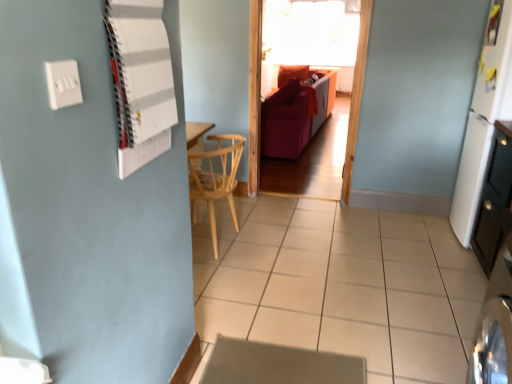
Measure the distance between white matte board at upper left and camera.

white matte board at upper left and camera are 37.68 inches apart.

The image size is (512, 384). What do you see at coordinates (295, 112) in the screenshot?
I see `velvet red couch at center` at bounding box center [295, 112].

The image size is (512, 384). What do you see at coordinates (215, 179) in the screenshot?
I see `natural wood chair at center` at bounding box center [215, 179].

At what (x,y) coordinates should I click in order to perform the action: click on white glossy dresser at right. Please return your answer as a coordinate pair (x, y). This screenshot has height=384, width=512. Looking at the image, I should click on [495, 199].

In order to face white plastic switch at upper left, should I rotate leftwards or rightwards?

Rotate your view left by about 24.011°.

Identify the location of transparent glass door at center. (254, 98).

Between natural wood chair at center and white matte board at upper left, which one appears on the left side from the viewer's perspective?

white matte board at upper left.

How different are the orientations of natural wood chair at center and white matte board at upper left in degrees?

They differ by 0.594 degrees in their facing directions.

Can you confirm if natural wood chair at center is bigger than white matte board at upper left?

Yes, natural wood chair at center is bigger than white matte board at upper left.

Would you say natural wood chair at center is inside or outside white matte board at upper left?

The correct answer is: outside.

Who is bigger, white tile at center or white plastic switch at upper left?

With larger size is white tile at center.

Which object is closer to the camera, white tile at center or white plastic switch at upper left?

white plastic switch at upper left is closer to the camera.

Measure the distance between white tile at center and white plastic switch at upper left.

6.50 feet.

Is velvet red couch at center positioned in front of transparent glass door at center?

That is False.

From a real-world perspective, is velvet red couch at center beneath transparent glass door at center?

Yes, from a real-world perspective, velvet red couch at center is under transparent glass door at center.

Is point (304, 104) positioned before point (252, 89)?

No, (304, 104) is further to viewer.

From the image's perspective, between velvet red couch at center and transparent glass door at center, who is located below?

transparent glass door at center appears lower in the image.

Is velvet red couch at center to the left of white tile at center from the viewer's perspective?

No.

Is velvet red couch at center smaller than white tile at center?

No, velvet red couch at center is not smaller than white tile at center.

Is velvet red couch at center in contact with white tile at center?

No, velvet red couch at center is not in contact with white tile at center.

Is velvet red couch at center aimed at white tile at center?

No, velvet red couch at center does not turn towards white tile at center.

Does white matte refrigerator at right have a larger size compared to white tile at center?

Incorrect, white matte refrigerator at right is not larger than white tile at center.

From a real-world perspective, which object rests below the other?

From a 3D spatial view, white tile at center is below.

How many degrees apart are the facing directions of white matte refrigerator at right and white tile at center?

90.5 degrees.

In the image, is white matte refrigerator at right on the left side or the right side of white tile at center?

In the image, white matte refrigerator at right appears on the right side of white tile at center.

Which of these two, white plastic switch at upper left or transparent glass window at upper center, stands taller?

With more height is transparent glass window at upper center.

Who is more distant, white plastic switch at upper left or transparent glass window at upper center?

transparent glass window at upper center is more distant.

Is white plastic switch at upper left oriented away from transparent glass window at upper center?

No, white plastic switch at upper left's orientation is not away from transparent glass window at upper center.

Based on the photo, what's the angular difference between natural wood chair at center and velvet red couch at center's facing directions?

176 degrees.

Is natural wood chair at center completely or partially outside of velvet red couch at center?

Indeed, natural wood chair at center is completely outside velvet red couch at center.

From the image's perspective, is natural wood chair at center positioned above or below velvet red couch at center?

natural wood chair at center is below velvet red couch at center.

From a real-world perspective, is natural wood chair at center located higher than velvet red couch at center?

Incorrect, from a real-world perspective, natural wood chair at center is lower than velvet red couch at center.

This screenshot has width=512, height=384. I want to click on bulletin board above the natural wood chair at center (from a real-world perspective), so click(x=140, y=80).

Identify the location of electric outlet on the left of white tile at center. This screenshot has width=512, height=384. (63, 84).

From the image, which object appears to be farther from white matte board at upper left, white matte refrigerator at right or beige carpet at lower center?

white matte refrigerator at right.

Estimate the real-world distances between objects in this image. Which object is further from white matte refrigerator at right, white plastic switch at upper left or transparent glass window at upper center?

Based on the image, transparent glass window at upper center appears to be further to white matte refrigerator at right.

When comparing their distances from white matte refrigerator at right, does transparent glass door at center or velvet red couch at center seem closer?

transparent glass door at center is positioned closer to the anchor white matte refrigerator at right.

Based on their spatial positions, is white matte refrigerator at right or white plastic switch at upper left further from natural wood chair at center?

Result: white plastic switch at upper left is positioned further to the anchor natural wood chair at center.

Estimate the real-world distances between objects in this image. Which object is closer to white tile at center, transparent glass door at center or white matte board at upper left?

transparent glass door at center.

In the scene shown: From the image, which object appears to be nearer to beige carpet at lower center, velvet red couch at center or white matte refrigerator at right?

white matte refrigerator at right is positioned closer to the anchor beige carpet at lower center.

Estimate the real-world distances between objects in this image. Which object is closer to beige carpet at lower center, natural wood chair at center or white plastic switch at upper left?

The object closer to beige carpet at lower center is natural wood chair at center.

In the scene shown: Considering their positions, is transparent glass window at upper center positioned closer to white plastic switch at upper left than white tile at center?

white tile at center is closer to white plastic switch at upper left.

The height and width of the screenshot is (384, 512). Identify the location of dresser located between white matte board at upper left and white matte refrigerator at right in the left-right direction. (x=495, y=199).

At what (x,y) coordinates should I click in order to perform the action: click on studio couch positioned between white plastic switch at upper left and transparent glass window at upper center from near to far. Please return your answer as a coordinate pair (x, y). Looking at the image, I should click on (295, 112).

The width and height of the screenshot is (512, 384). Identify the location of chair positioned between beige carpet at lower center and velvet red couch at center from near to far. (215, 179).

Identify the location of fridge between white plastic switch at upper left and transparent glass door at center from front to back. The height and width of the screenshot is (384, 512). (483, 119).